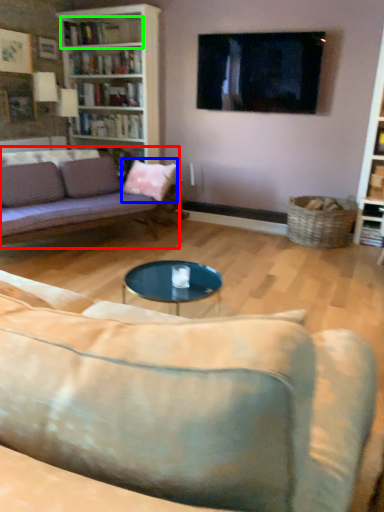
Question: Which is farther away from studio couch (highlighted by a red box)? throw pillow (highlighted by a blue box) or shelf (highlighted by a green box)?

Choices:
 (A) throw pillow
 (B) shelf

Answer: (B)